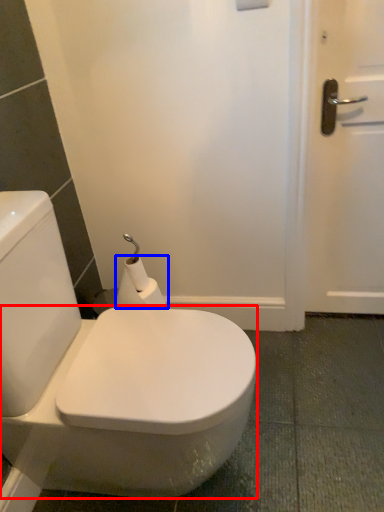
Question: Which object appears farthest to the camera in this image, bidet (highlighted by a red box) or toilet paper (highlighted by a blue box)?

Choices:
 (A) bidet
 (B) toilet paper

Answer: (B)